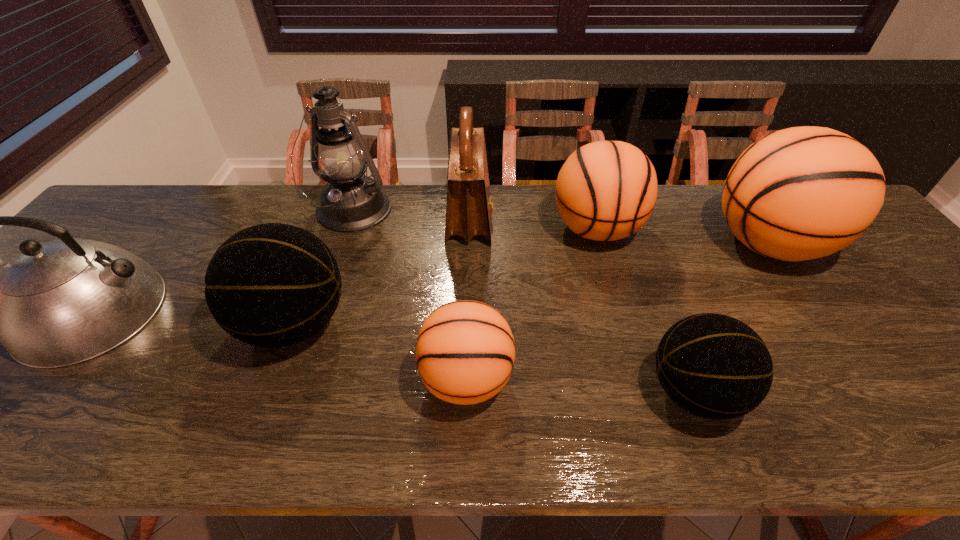
Where is `object that is the sixth nearest to the biggest orange basketball`? object that is the sixth nearest to the biggest orange basketball is located at coordinates (272, 285).

Image resolution: width=960 pixels, height=540 pixels. What are the coordinates of `basketball that is the fourth nearest to the oil lamp` in the screenshot? It's located at (714, 366).

The height and width of the screenshot is (540, 960). In order to click on basketball that is the fifth closest one to the oil lamp in this screenshot , I will do `click(801, 193)`.

Select which orange basketball is the third closest to the shoulder bag. Please provide its 2D coordinates. Your answer should be formatted as a tuple, i.e. [(x, y)], where the tuple contains the x and y coordinates of a point satisfying the conditions above.

[(801, 193)]

Identify which orange basketball is the second closest to the shoulder bag. Please provide its 2D coordinates. Your answer should be formatted as a tuple, i.e. [(x, y)], where the tuple contains the x and y coordinates of a point satisfying the conditions above.

[(465, 352)]

This screenshot has height=540, width=960. I want to click on vacant area in the image that satisfies the following two spatial constraints: 1. on the back side of the second biggest orange basketball; 2. on the front flap of the shoulder bag, so click(x=593, y=220).

This screenshot has width=960, height=540. Identify the location of free point that satisfies the following two spatial constraints: 1. on the back side of the rightmost orange basketball; 2. on the left side of the left black basketball. (324, 244).

Image resolution: width=960 pixels, height=540 pixels. Identify the location of vacant region that satisfies the following two spatial constraints: 1. on the back side of the smaller black basketball; 2. on the front flap of the shoulder bag. (630, 220).

This screenshot has height=540, width=960. Identify the location of free spot that satisfies the following two spatial constraints: 1. on the back side of the leftmost basketball; 2. on the left side of the second orange basketball from left to right. (329, 230).